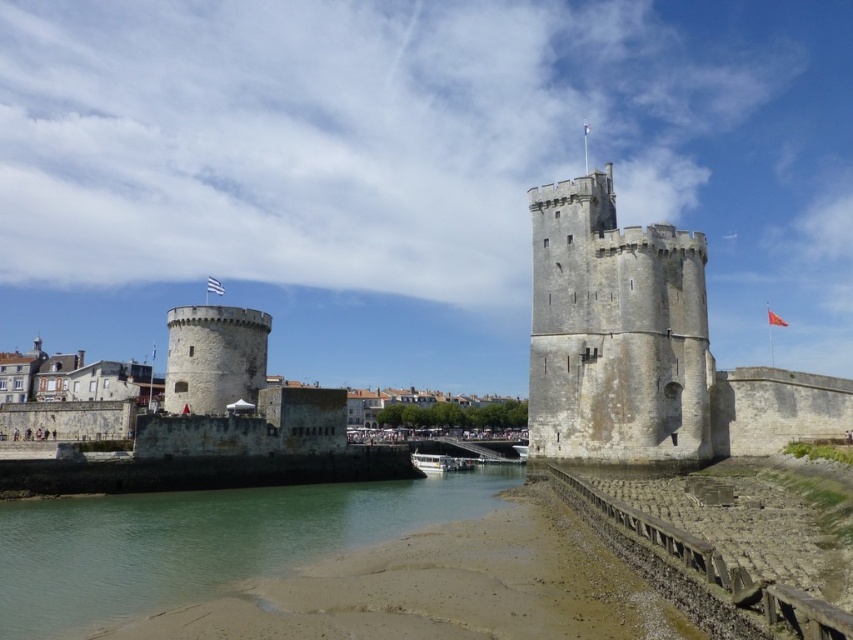
Question: Is green sand at lower left positioned at the back of white fabric flag at center?

Choices:
 (A) yes
 (B) no

Answer: (B)

Question: From the image, what is the correct spatial relationship of green sand at lower left in relation to gray stone tower at center?

Choices:
 (A) above
 (B) below

Answer: (B)

Question: Estimate the real-world distances between objects in this image. Which object is farther from the red fabric flag at upper center?

Choices:
 (A) gray stone tower at center
 (B) green sand at lower left
 (C) white fabric flag at center

Answer: (B)

Question: Where is green sand at lower left located in relation to white fabric flag at center in the image?

Choices:
 (A) right
 (B) left

Answer: (A)

Question: Among these points, which one is farthest from the camera?

Choices:
 (A) (680, 445)
 (B) (287, 560)
 (C) (221, 285)
 (D) (769, 323)

Answer: (D)

Question: Which is farther from the white fabric flag at center?

Choices:
 (A) red fabric flag at upper center
 (B) green sand at lower left

Answer: (A)